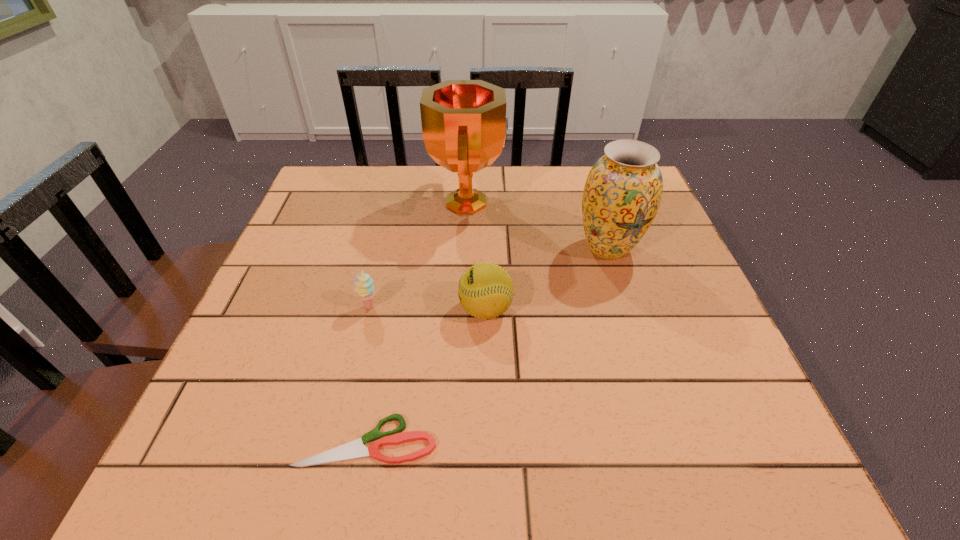
Locate an element on the screen. Image resolution: width=960 pixels, height=540 pixels. vacant area between the fourth shortest object and the award is located at coordinates [538, 225].

You are a GUI agent. You are given a task and a screenshot of the screen. Output one action in this format:
    pyautogui.click(x=<x>, y=<y>)
    Task: Click on the empty space between the softball and the scissors
    This screenshot has height=540, width=960.
    Given the screenshot: What is the action you would take?
    click(426, 375)

Select which object appears as the fourth closest to the award. Please provide its 2D coordinates. Your answer should be formatted as a tuple, i.e. [(x, y)], where the tuple contains the x and y coordinates of a point satisfying the conditions above.

[(356, 449)]

Locate an element on the screen. Image resolution: width=960 pixels, height=540 pixels. object that ranks as the fourth closest to the fourth shortest object is located at coordinates (356, 449).

This screenshot has height=540, width=960. In order to click on vacant region that satisfies the following two spatial constraints: 1. on the back side of the rightmost object; 2. on the left side of the sherbert in this screenshot , I will do `click(383, 248)`.

This screenshot has width=960, height=540. In order to click on free spot that satisfies the following two spatial constraints: 1. on the side of the award with the star emblem; 2. on the back side of the vase in this screenshot , I will do `click(467, 248)`.

Find the location of `free space that satisfies the following two spatial constraints: 1. on the side of the award with the star emblem; 2. on the back side of the second tallest object`. free space that satisfies the following two spatial constraints: 1. on the side of the award with the star emblem; 2. on the back side of the second tallest object is located at coordinates (467, 248).

At what (x,y) coordinates should I click in order to perform the action: click on vacant region that satisfies the following two spatial constraints: 1. on the side of the award with the star emblem; 2. on the left side of the vase. Please return your answer as a coordinate pair (x, y). Looking at the image, I should click on [467, 248].